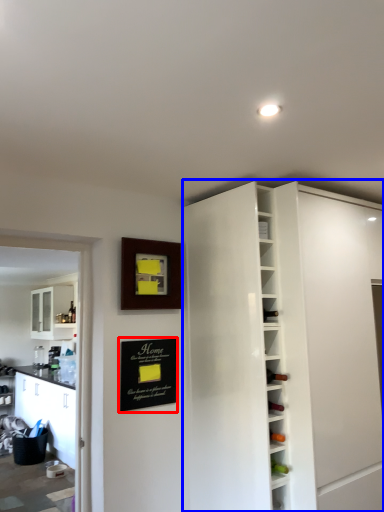
Question: Which object appears farthest to the camera in this image, bulletin board (highlighted by a red box) or cabinetry (highlighted by a blue box)?

Choices:
 (A) bulletin board
 (B) cabinetry

Answer: (A)